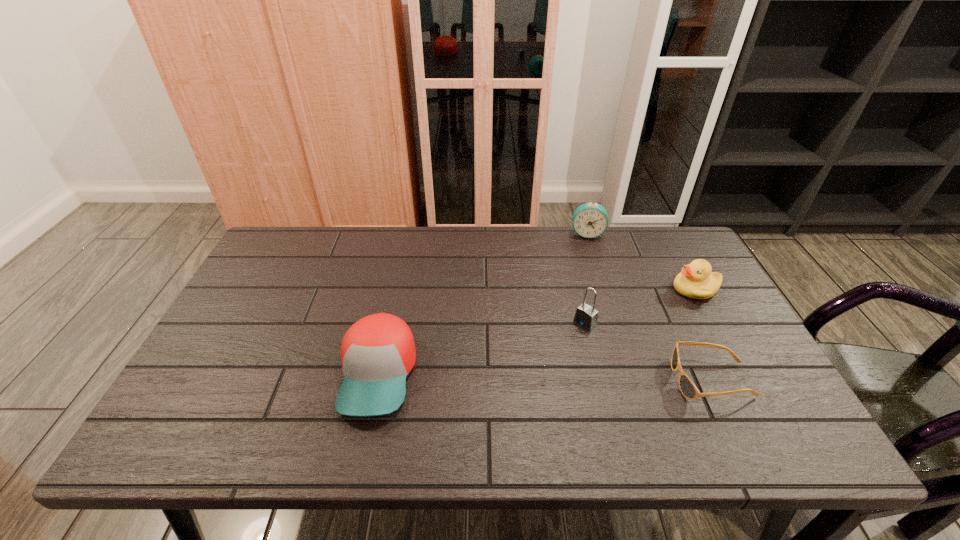
Find the location of a particular element. The width and height of the screenshot is (960, 540). free space on the desktop that is between the baseball cap and the shortest object and is positioned on the shackle of the padlock is located at coordinates (523, 376).

Locate an element on the screen. The width and height of the screenshot is (960, 540). vacant spot on the desktop that is between the baseball cap and the shortest object and is positioned on the front-facing side of the second farthest object is located at coordinates (510, 376).

Identify the location of vacant spot on the desktop that is between the leftmost object and the sunglasses and is positioned on the front-facing side of the farthest object. The height and width of the screenshot is (540, 960). (590, 377).